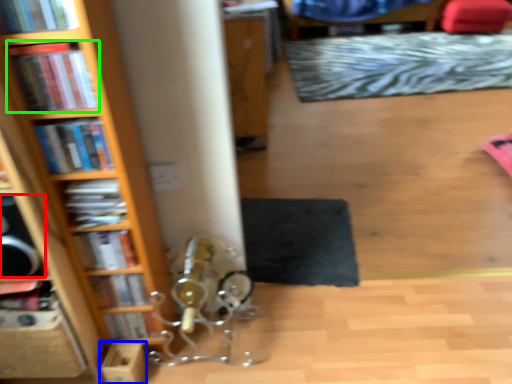
Question: Which object is positioned closest to speaker (highlighted by a red box)? Select from cardboard box (highlighted by a blue box) and book (highlighted by a green box).

Choices:
 (A) cardboard box
 (B) book

Answer: (B)